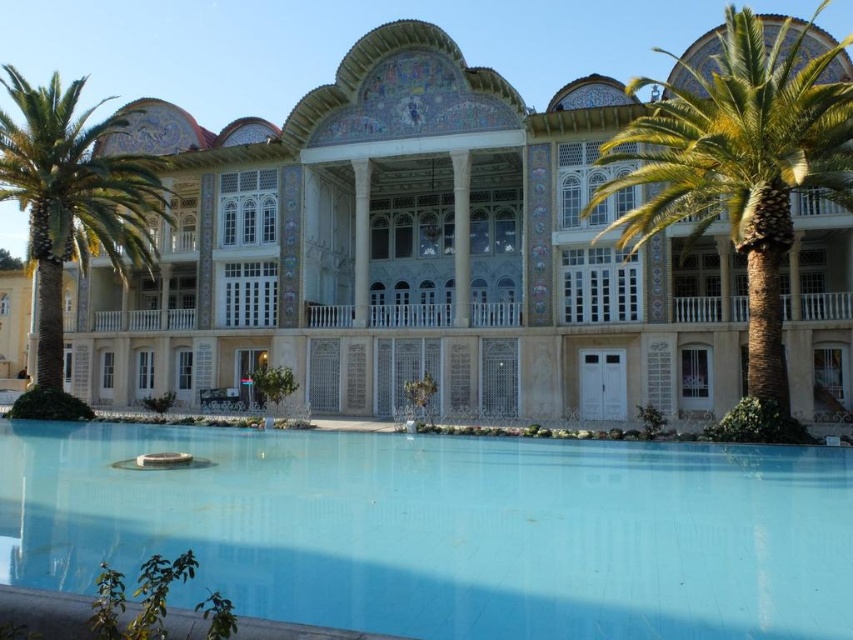
Question: Which point is closer to the camera?

Choices:
 (A) (776, 145)
 (B) (55, 157)
 (C) (326, 200)
 (D) (795, 508)

Answer: (D)

Question: Is beige stone building at center smaller than blue tile swimming pool at center?

Choices:
 (A) no
 (B) yes

Answer: (A)

Question: Is green leafy palm tree at right to the right of green leafy palm tree at left from the viewer's perspective?

Choices:
 (A) yes
 (B) no

Answer: (A)

Question: Which point is closer to the camera taking this photo?

Choices:
 (A) coord(155,532)
 (B) coord(602,157)
 (C) coord(444,257)

Answer: (A)

Question: Is beige stone building at center closer to the viewer compared to green leafy palm tree at right?

Choices:
 (A) no
 (B) yes

Answer: (A)

Question: Which object is closer to the camera taking this photo?

Choices:
 (A) green leafy palm tree at right
 (B) blue tile swimming pool at center

Answer: (B)